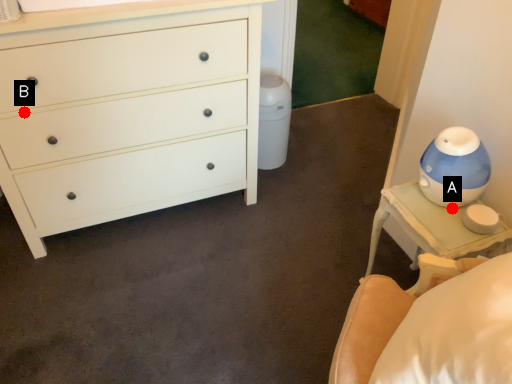
Question: Two points are circled on the image, labeled by A and B beside each circle. Which point appears closest to the camera in this image?

Choices:
 (A) A is closer
 (B) B is closer

Answer: (A)